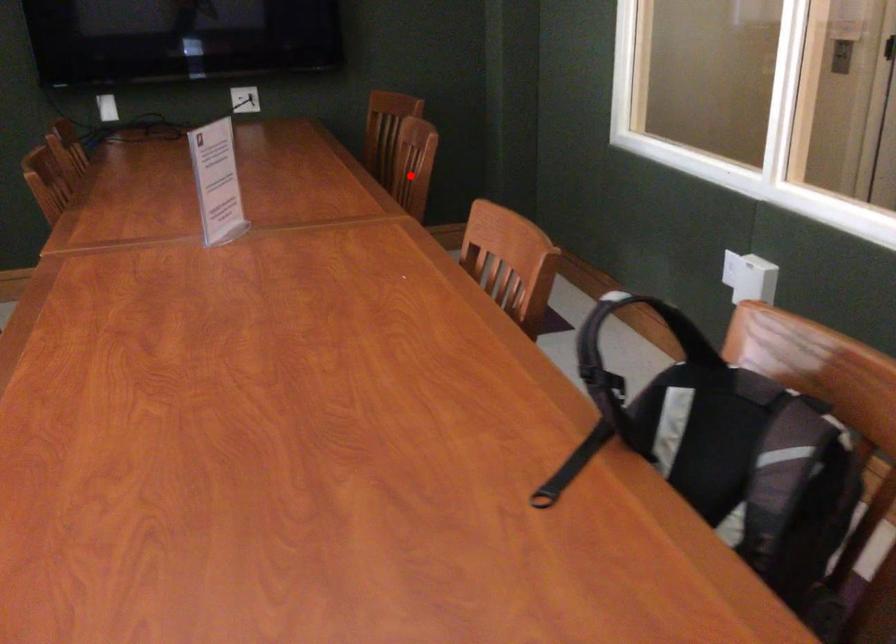
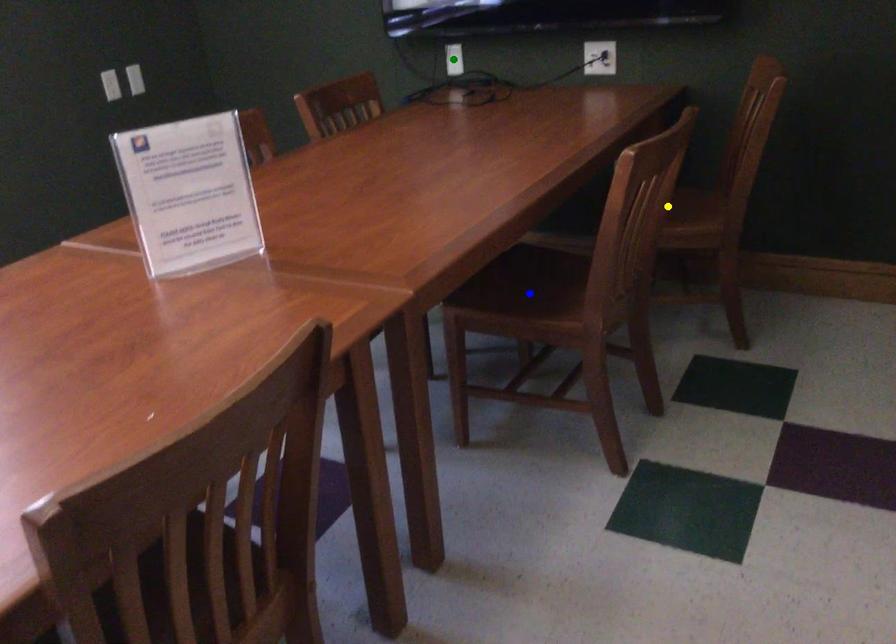
Question: I am providing you with two images of the same scene from different viewpoints. A red point is marked on the first image. You are given multiple points on the second image. Which point in image 2 represents the same 3d spot as the red point in image 1?

Choices:
 (A) green point
 (B) yellow point
 (C) blue point

Answer: (B)